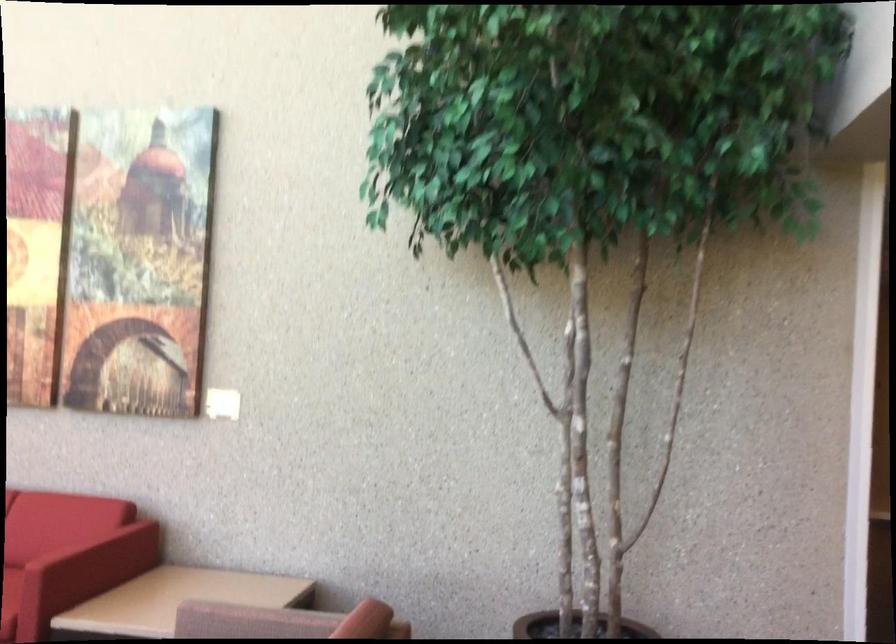
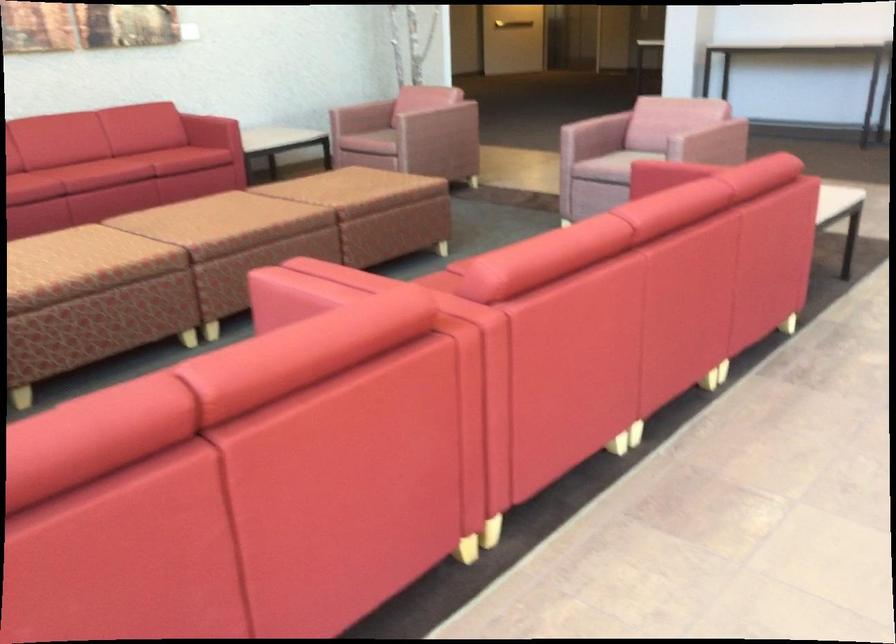
The point at (355, 620) is marked in the first image. Where is the corresponding point in the second image?

(428, 80)